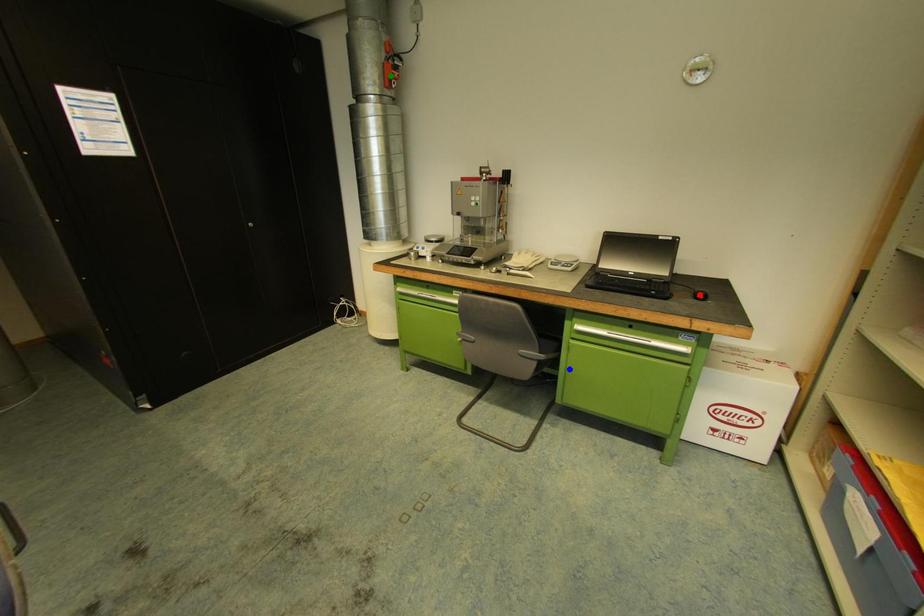
Order these from nearest to farthest:
- blue point
- green point
- red point

red point < blue point < green point